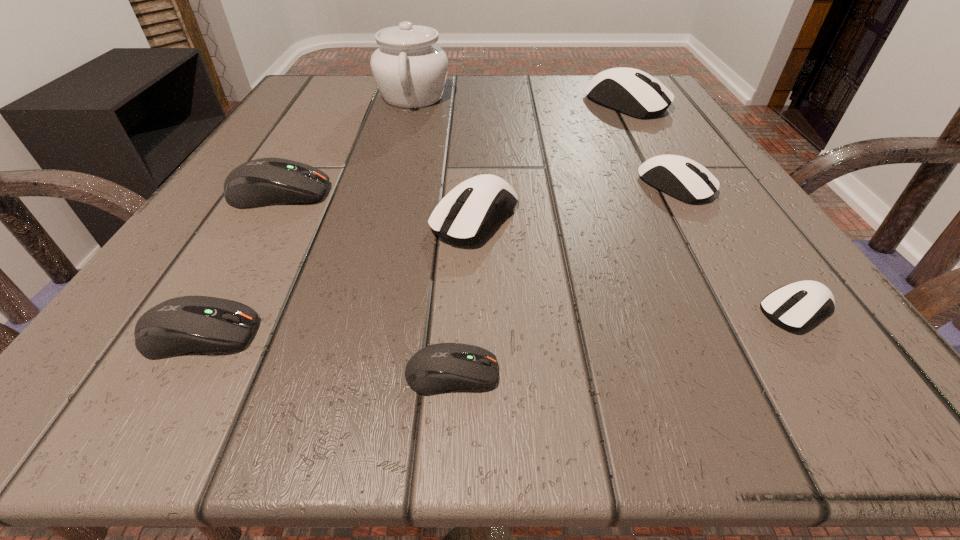
Identify the location of object situated at the near left corner. (188, 324).

Image resolution: width=960 pixels, height=540 pixels. I want to click on object situated at the far right corner, so click(x=633, y=92).

Where is `object at the near right corner`? This screenshot has width=960, height=540. object at the near right corner is located at coordinates (790, 306).

Where is `free space at the far edge of the desktop`? free space at the far edge of the desktop is located at coordinates (549, 78).

Find the location of a particular element. Image resolution: width=960 pixels, height=540 pixels. vacant space at the near edge of the desktop is located at coordinates (707, 381).

Identify the location of vacant space at the left edge of the desktop. This screenshot has height=540, width=960. (270, 285).

In the image, there is a desktop. Identify the location of vacant region at the right edge. (756, 249).

Image resolution: width=960 pixels, height=540 pixels. I want to click on blank space at the near left corner of the desktop, so click(x=121, y=373).

Where is `free point at the far right corner`? This screenshot has height=540, width=960. free point at the far right corner is located at coordinates (682, 114).

Locate an element on the screen. vacant region at the near right corner is located at coordinates (804, 349).